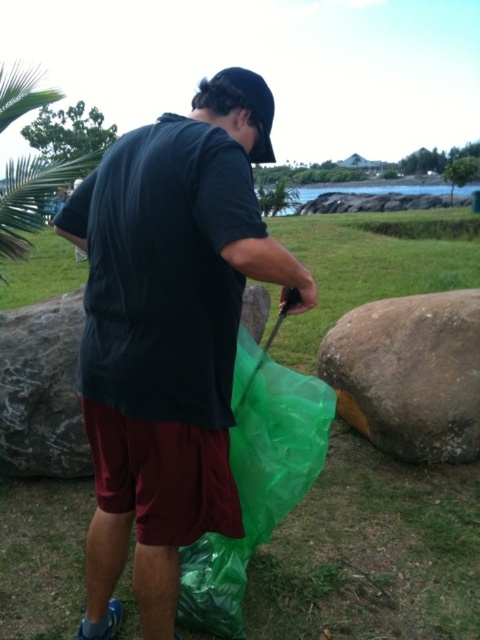
Does green plastic bag at center have a lesser height compared to brown rough boulder at right?

No.

Is point (358, 225) behind point (388, 435)?

Yes.

Locate an element on the screen. The height and width of the screenshot is (640, 480). green plastic bag at center is located at coordinates (372, 552).

Where is `green plastic bag at center`? The width and height of the screenshot is (480, 640). green plastic bag at center is located at coordinates (372, 552).

Describe the element at coordinates (167, 340) in the screenshot. This screenshot has height=640, width=480. I see `matte black shirt at center` at that location.

Who is higher up, matte black shirt at center or brown rough boulder at right?

matte black shirt at center

Between point (269, 243) and point (460, 346), which one is positioned in front?

Point (269, 243) is in front.

Image resolution: width=480 pixels, height=640 pixels. I want to click on matte black shirt at center, so (x=167, y=340).

Can you confirm if matte black shirt at center is shorter than black fabric baseball hat at upper center?

In fact, matte black shirt at center may be taller than black fabric baseball hat at upper center.

Identify the location of matte black shirt at center. (167, 340).

You are a GUI agent. You are given a task and a screenshot of the screen. Output one action in this format:
    pyautogui.click(x=<x>, y=<y>)
    Task: Click on the matte black shirt at center
    
    Given the screenshot: What is the action you would take?
    pyautogui.click(x=167, y=340)